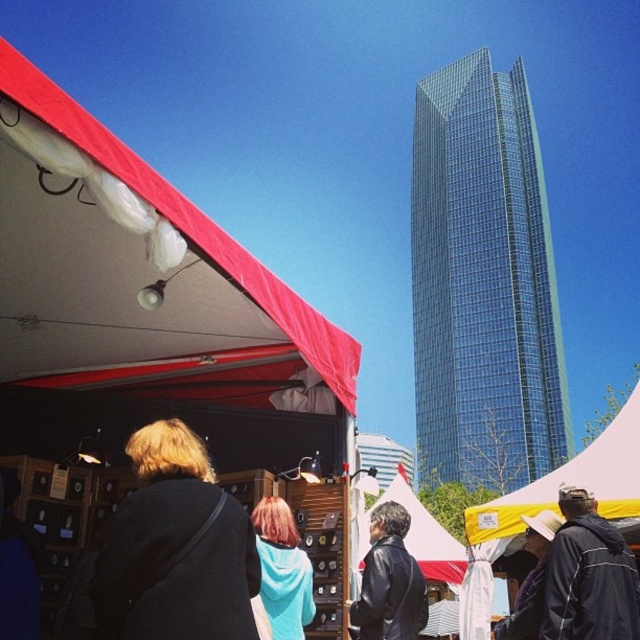
You are standing at the market entrance and see two points marked in the image. The first point is at coordinates point (458,419) and the second is at point (420,605). Which point is closer to you?

Point (420,605) is closer to you because it is in front of point (458,419).

You are standing at the camera position and want to take a photo of the transparent glass skyscraper at upper center. The camera has a maximum zoom range of 100 feet. Can you capture the skyscraper without moving closer?

The transparent glass skyscraper at upper center and camera are 257.89 feet apart from each other. Since the camera can only zoom up to 100 feet, you cannot capture the skyscraper without moving closer.